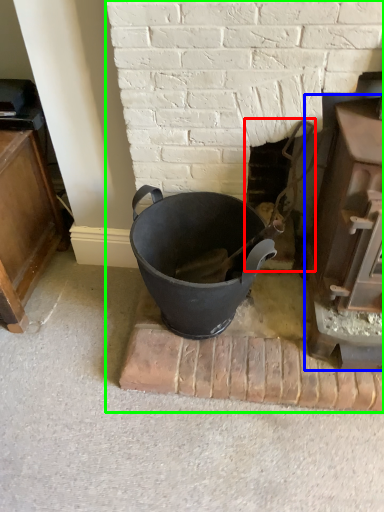
Question: Which is farther away from fireplace (highlighted by a red box)? fireplace (highlighted by a blue box) or fireplace (highlighted by a green box)?

Choices:
 (A) fireplace
 (B) fireplace

Answer: (A)